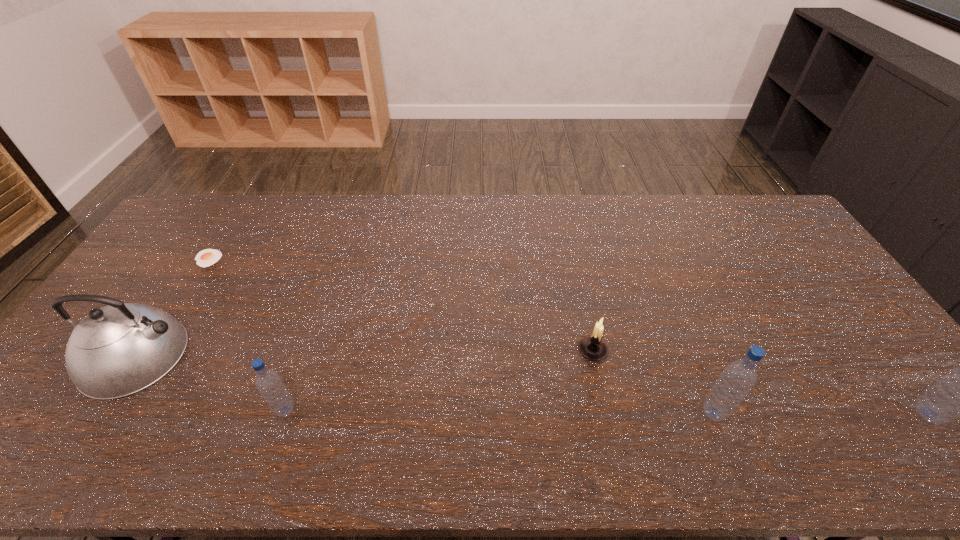
Select which water bottle is the second closest to the rightmost object. Please provide its 2D coordinates. Your answer should be formatted as a tuple, i.e. [(x, y)], where the tuple contains the x and y coordinates of a point satisfying the conditions above.

[(268, 382)]

Find the location of a particular element. This screenshot has height=540, width=960. water bottle that is the closest to the farthest object is located at coordinates (268, 382).

This screenshot has width=960, height=540. I want to click on free region that satisfies the following two spatial constraints: 1. on the back side of the third shortest object; 2. from the spout of the kettle, so click(304, 355).

I want to click on vacant space that satisfies the following two spatial constraints: 1. from the spout of the kettle; 2. on the right side of the rightmost object, so click(x=98, y=414).

Identify the location of free region that satisfies the following two spatial constraints: 1. on the front side of the shortest water bottle; 2. on the right side of the shortest object. (110, 410).

The width and height of the screenshot is (960, 540). I want to click on blank area in the image that satisfies the following two spatial constraints: 1. on the front side of the second water bottle from left to right; 2. on the right side of the fourth object from left to right, so click(607, 413).